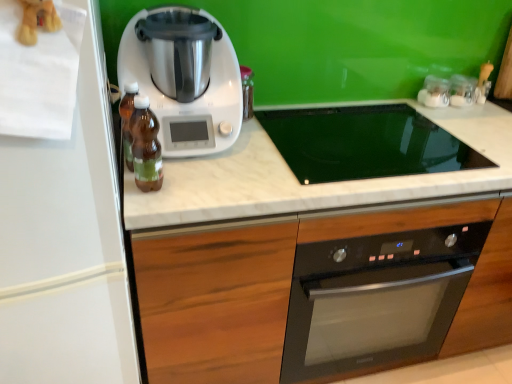
You are a GUI agent. You are given a task and a screenshot of the screen. Output one action in this format:
    pyautogui.click(x=<x>, y=<y>)
    Task: Click on the vacant area that lies between brown glass bottle at left, positioned as the 2th bottle in front-to-back order, and clear glass jars at upper right, the 2th appliance when ordered from right to left
    
    Given the screenshot: What is the action you would take?
    pyautogui.click(x=324, y=129)